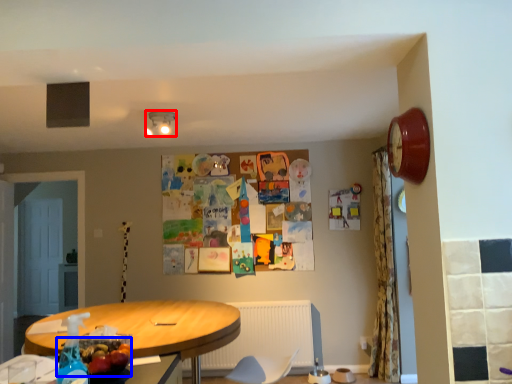
Question: Which object is closer to the camera taking this photo, lamp (highlighted by a red box) or food (highlighted by a blue box)?

Choices:
 (A) lamp
 (B) food

Answer: (B)